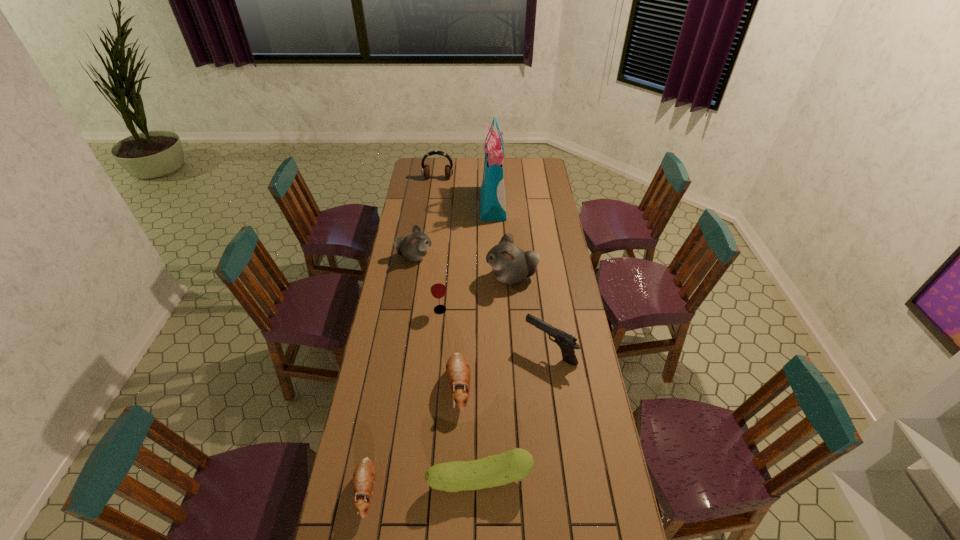
Identify the location of vacant area situated on the ear cup of the headset. (433, 215).

Locate an element on the screen. Image resolution: width=960 pixels, height=540 pixels. vacant area situated 0.220m on the front of the glass is located at coordinates click(436, 358).

You are a GUI agent. You are given a task and a screenshot of the screen. Output one action in this format:
    pyautogui.click(x=<x>, y=<y>)
    Task: Click on the vacant space located 0.060m on the face of the smaller white hamster
    
    Given the screenshot: What is the action you would take?
    pyautogui.click(x=445, y=256)

Locate an element on the screen. The height and width of the screenshot is (540, 960). vacant region located at the muzzle of the gun is located at coordinates (468, 351).

Find the location of a particular element. free spot located at the muzzle of the gun is located at coordinates (448, 351).

Find the location of a particular element. This screenshot has height=540, width=960. vacant space located at the muzzle of the gun is located at coordinates (451, 351).

This screenshot has height=540, width=960. Find the location of `free space located at the face of the farther brown hamster`. free space located at the face of the farther brown hamster is located at coordinates (455, 485).

Identify the location of vacant space situated 0.230m on the left of the green cucumber. (354, 479).

You are a GUI agent. You are given a task and a screenshot of the screen. Output one action in this format:
    pyautogui.click(x=<x>, y=<y>)
    Task: Click on the object that is at the far edge
    Image resolution: width=960 pixels, height=540 pixels.
    Given the screenshot: What is the action you would take?
    pyautogui.click(x=425, y=171)

Locate an element on the screen. headset that is at the left edge is located at coordinates (425, 171).